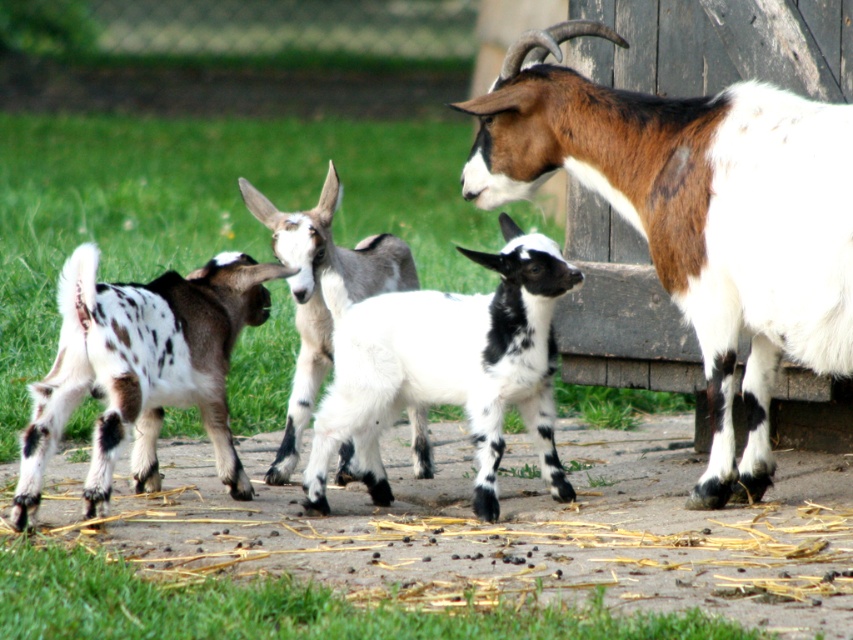
Question: Which of the following is the closest to the observer?

Choices:
 (A) (343, 480)
 (B) (656, 97)
 (C) (160, 422)
 (D) (527, 278)

Answer: (D)

Question: Which point appears closest to the camera in this image?

Choices:
 (A) (267, 211)
 (B) (178, 356)
 (C) (749, 195)

Answer: (C)

Question: Which point is closer to the camera?

Choices:
 (A) (155, 369)
 (B) (292, 278)

Answer: (A)

Question: Can you confirm if brown and white fur at right is positioned to the right of spotted fur kid goat at left?

Choices:
 (A) yes
 (B) no

Answer: (A)

Question: Does brown and white fur at right appear on the right side of spotted fur goat at center?

Choices:
 (A) no
 (B) yes

Answer: (B)

Question: Is brown and white fur at right bigger than white soft fur goat at center?

Choices:
 (A) yes
 (B) no

Answer: (A)